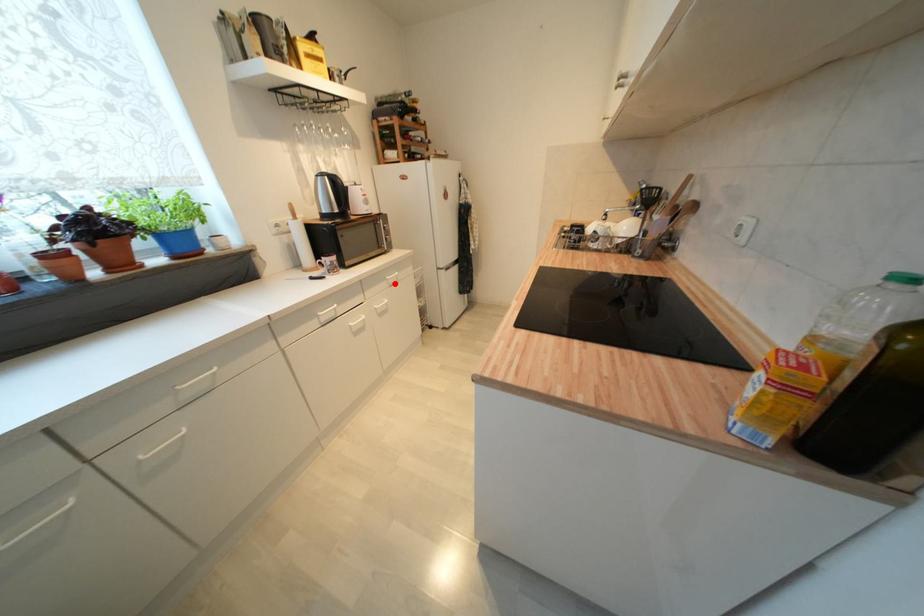
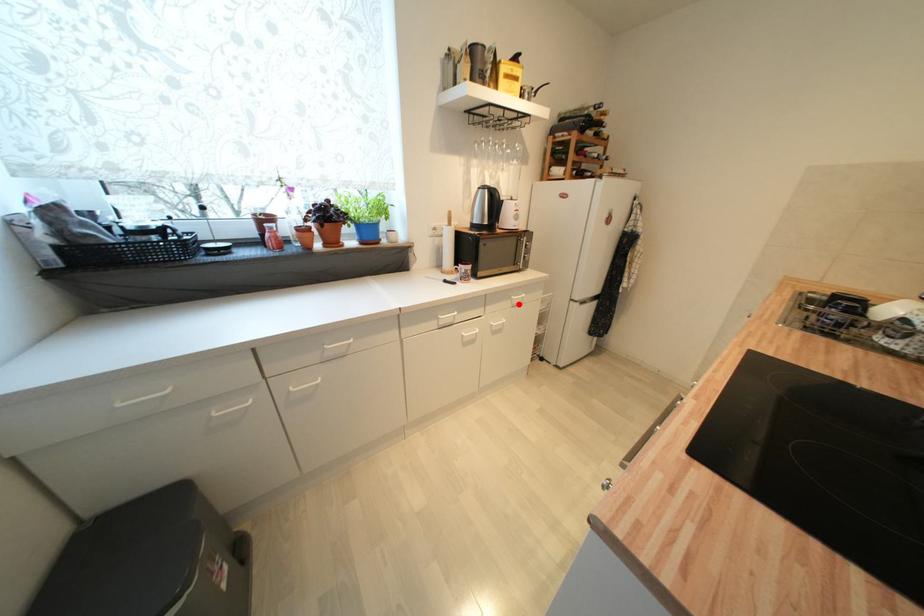
I am providing you with two images of the same scene from different viewpoints. A red point is marked on the first image and another point is marked on the second image. Is the marked point in image1 the same physical position as the marked point in image2?

Yes